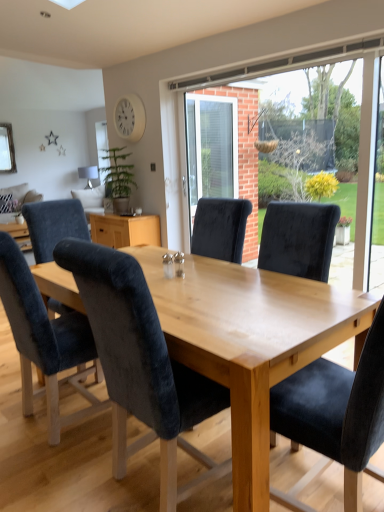
What do you see at coordinates (21, 196) in the screenshot?
I see `velvet blue pillow at left` at bounding box center [21, 196].

What are the coordinates of `transparent glass window at center` in the screenshot? It's located at (329, 138).

Locate an element on the screen. Image resolution: width=384 pixels, height=512 pixels. velvet dark blue chair at center, marked as the second chair in a right-to-left arrangement is located at coordinates (141, 365).

You are a GUI agent. You are given a task and a screenshot of the screen. Output one action in this format:
    pyautogui.click(x=<x>, y=<y>)
    Task: Click on the velvet dark blue chair at lower left, placed as the 3th chair when sorted from right to left
    The image size is (384, 512).
    Given the screenshot: What is the action you would take?
    pyautogui.click(x=44, y=339)

The image size is (384, 512). Identify the location of matte silver lamp at upper left. (89, 175).

Image resolution: width=384 pixels, height=512 pixels. Identify the location of white matte clock at upper center. (130, 118).

Find the location of `velvet blue chair at center, which appears as the 4th chair when viewed from the front`. velvet blue chair at center, which appears as the 4th chair when viewed from the front is located at coordinates (91, 200).

Where is `the 2nd chair below the velvet blue chair at center, acting as the first chair starting from the back (from a real-world perspective)`? The width and height of the screenshot is (384, 512). the 2nd chair below the velvet blue chair at center, acting as the first chair starting from the back (from a real-world perspective) is located at coordinates (141, 365).

Visually, is velvet blue chair at center, arranged as the first chair when viewed from the left, positioned to the left or to the right of velvet dark blue chair at center, the third chair when ordered from left to right?

In the image, velvet blue chair at center, arranged as the first chair when viewed from the left, appears on the left side of velvet dark blue chair at center, the third chair when ordered from left to right.

Can you confirm if velvet blue chair at center, arranged as the first chair when viewed from the left, is smaller than velvet dark blue chair at center, the third chair from the back?

Yes, velvet blue chair at center, arranged as the first chair when viewed from the left, is smaller than velvet dark blue chair at center, the third chair from the back.

How much distance is there between white matte clock at upper center and velvet dark blue chair at lower left, positioned as the second chair in left-to-right order?

The distance of white matte clock at upper center from velvet dark blue chair at lower left, positioned as the second chair in left-to-right order, is 9.77 feet.

Considering the relative sizes of white matte clock at upper center and velvet dark blue chair at lower left, placed as the 3th chair when sorted from right to left, in the image provided, is white matte clock at upper center bigger than velvet dark blue chair at lower left, placed as the 3th chair when sorted from right to left,?

No.

From the image's perspective, starting from the white matte clock at upper center, which chair is the 2nd one below? Please provide its 2D coordinates.

[(44, 339)]

Is velvet blue chair at center, acting as the first chair starting from the back, located outside transparent glass window at center?

Indeed, velvet blue chair at center, acting as the first chair starting from the back, is completely outside transparent glass window at center.

In the scene shown: Which object is further away from the camera, velvet blue chair at center, which appears as the 4th chair when viewed from the front, or transparent glass window at center?

velvet blue chair at center, which appears as the 4th chair when viewed from the front, is further from the camera.

I want to click on the 4th chair to the left of the transparent glass window at center, starting your count from the anchor, so click(x=91, y=200).

From the image's perspective, which object appears higher, velvet blue chair at center, acting as the first chair starting from the back, or transparent glass window at center?

velvet blue chair at center, acting as the first chair starting from the back.

From the image's perspective, between white matte clock at upper center and transparent glass window at center, who is located below?

transparent glass window at center, from the image's perspective.

Can you tell me how much white matte clock at upper center and transparent glass window at center differ in facing direction?

0.608 degrees.

Consider the image. Is white matte clock at upper center situated inside transparent glass window at center or outside?

white matte clock at upper center lies outside transparent glass window at center.

From the picture: Is white matte clock at upper center next to transparent glass window at center?

No, white matte clock at upper center is not beside transparent glass window at center.

In the image, is matte silver lamp at upper left on the left side or the right side of velvet dark blue chair at center, the third chair when ordered from left to right?

matte silver lamp at upper left is positioned on velvet dark blue chair at center, the third chair when ordered from left to right,'s left side.

Is matte silver lamp at upper left far away from velvet dark blue chair at center, which is counted as the 2th chair, starting from the front?

Yes, matte silver lamp at upper left and velvet dark blue chair at center, which is counted as the 2th chair, starting from the front, are quite far apart.

Could you measure the distance between matte silver lamp at upper left and velvet dark blue chair at center, which is counted as the 2th chair, starting from the front?

matte silver lamp at upper left is 6.03 meters from velvet dark blue chair at center, which is counted as the 2th chair, starting from the front.

From the image's perspective, is matte silver lamp at upper left on top of velvet dark blue chair at center, the third chair when ordered from left to right?

Yes, from the image's perspective, matte silver lamp at upper left is on top of velvet dark blue chair at center, the third chair when ordered from left to right.

In the scene shown: Does matte silver lamp at upper left appear on the left side of velvet blue couch at left?

In fact, matte silver lamp at upper left is to the right of velvet blue couch at left.

In the scene shown: Is velvet blue couch at left at the back of matte silver lamp at upper left?

No, matte silver lamp at upper left is not facing the opposite direction of velvet blue couch at left.

Is matte silver lamp at upper left touching velvet blue couch at left?

No, matte silver lamp at upper left is not touching velvet blue couch at left.

From the image's perspective, is matte silver lamp at upper left positioned above or below velvet blue couch at left?

From the image's perspective, matte silver lamp at upper left appears above velvet blue couch at left.

Is velvet blue couch at left turned away from velvet dark blue chair at center, which is counted as the 2th chair, starting from the front?

velvet blue couch at left is not turned away from velvet dark blue chair at center, which is counted as the 2th chair, starting from the front.

From the velvet blue couch at left, count 3rd chair to the right and point to it. Please provide its 2D coordinates.

[(141, 365)]

From the image's perspective, relative to velvet dark blue chair at center, the third chair when ordered from left to right, is velvet blue couch at left above or below?

velvet blue couch at left is situated higher than velvet dark blue chair at center, the third chair when ordered from left to right, in the image.

The image size is (384, 512). I want to click on the 2nd chair positioned below the velvet blue chair at center, acting as the first chair starting from the back (from the image's perspective), so click(x=141, y=365).

Locate an element on the screen. The height and width of the screenshot is (512, 384). chair that is the 1st object located in front of the white matte clock at upper center is located at coordinates tap(44, 339).

Which object lies nearer to the anchor point velvet dark blue chair at center, the third chair when ordered from left to right, transparent glass window at center or white matte clock at upper center?

white matte clock at upper center is positioned closer to the anchor velvet dark blue chair at center, the third chair when ordered from left to right.

Looking at the image, which one is located further to transparent glass window at center, velvet blue pillow at left or velvet dark blue chair at lower left, placed as the 3th chair when sorted from right to left?

Among the two, velvet dark blue chair at lower left, placed as the 3th chair when sorted from right to left, is located further to transparent glass window at center.

When comparing their distances from white matte clock at upper center, does matte silver lamp at upper left or velvet blue couch at left seem closer?

velvet blue couch at left is positioned closer to the anchor white matte clock at upper center.

Considering their positions, is velvet blue chair at center, arranged as the first chair when viewed from the left, positioned closer to velvet dark blue chair at lower left, placed as the 3th chair when sorted from right to left, than velvet blue couch at left?

velvet blue couch at left.

Estimate the real-world distances between objects in this image. Which object is further from matte silver lamp at upper left, velvet black chair at center, arranged as the 4th chair when viewed from the left, or velvet dark blue chair at center, which is counted as the 2th chair, starting from the front?

velvet black chair at center, arranged as the 4th chair when viewed from the left, is positioned further to the anchor matte silver lamp at upper left.

Which object lies nearer to the anchor point transparent glass window at center, white matte clock at upper center or velvet dark blue chair at center, marked as the second chair in a right-to-left arrangement?

white matte clock at upper center.

From the image, which object appears to be farther from velvet dark blue chair at center, marked as the second chair in a right-to-left arrangement, velvet black chair at center, arranged as the 4th chair when viewed from the left, or velvet dark blue chair at lower left, the 2th chair in the back-to-front sequence?

velvet dark blue chair at lower left, the 2th chair in the back-to-front sequence, lies further to velvet dark blue chair at center, marked as the second chair in a right-to-left arrangement, than the other object.

Looking at the image, which one is located further to velvet blue chair at center, acting as the first chair starting from the back, white matte clock at upper center or velvet black chair at center, the fourth chair positioned from the back?

velvet black chair at center, the fourth chair positioned from the back, is further to velvet blue chair at center, acting as the first chair starting from the back.

In order to click on studio couch between transparent glass window at center and matte silver lamp at upper left along the z-axis in this screenshot , I will do `click(18, 214)`.

Where is `studio couch positioned between transparent glass window at center and velvet blue pillow at left from near to far`? The width and height of the screenshot is (384, 512). studio couch positioned between transparent glass window at center and velvet blue pillow at left from near to far is located at coordinates (18, 214).

Find the location of a particular element. The width and height of the screenshot is (384, 512). window located between velvet black chair at center, placed as the first chair when sorted from front to back, and velvet blue couch at left in the depth direction is located at coordinates (329, 138).

Image resolution: width=384 pixels, height=512 pixels. I want to click on studio couch between white matte clock at upper center and velvet blue pillow at left along the z-axis, so click(x=18, y=214).